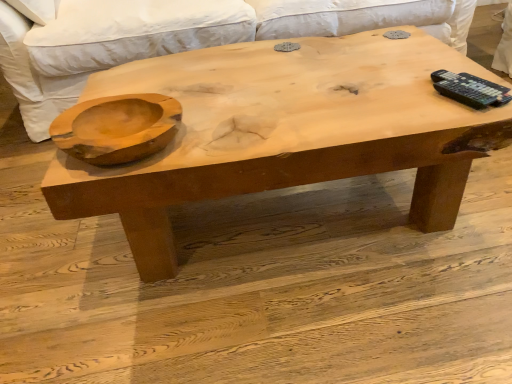
Question: Considering the relative sizes of natural wood coffee table at center and white fabric couch at upper center in the image provided, is natural wood coffee table at center thinner than white fabric couch at upper center?

Choices:
 (A) no
 (B) yes

Answer: (B)

Question: Considering the relative sizes of natural wood coffee table at center and white fabric couch at upper center in the image provided, is natural wood coffee table at center smaller than white fabric couch at upper center?

Choices:
 (A) yes
 (B) no

Answer: (A)

Question: From a real-world perspective, does natural wood coffee table at center stand above white fabric couch at upper center?

Choices:
 (A) no
 (B) yes

Answer: (A)

Question: From the image's perspective, is natural wood coffee table at center below white fabric couch at upper center?

Choices:
 (A) no
 (B) yes

Answer: (B)

Question: Are natural wood coffee table at center and white fabric couch at upper center far apart?

Choices:
 (A) yes
 (B) no

Answer: (B)

Question: From the image's perspective, is natural wood coffee table at center located above white fabric couch at upper center?

Choices:
 (A) yes
 (B) no

Answer: (B)

Question: Can you confirm if white fabric couch at upper center is wider than natural wood coffee table at center?

Choices:
 (A) yes
 (B) no

Answer: (A)

Question: Can we say white fabric couch at upper center lies outside natural wood coffee table at center?

Choices:
 (A) yes
 (B) no

Answer: (A)

Question: Is natural wood coffee table at center completely or partially inside white fabric couch at upper center?

Choices:
 (A) no
 (B) yes

Answer: (A)

Question: Is white fabric couch at upper center at the left side of natural wood coffee table at center?

Choices:
 (A) no
 (B) yes

Answer: (B)

Question: Is white fabric couch at upper center shorter than natural wood coffee table at center?

Choices:
 (A) yes
 (B) no

Answer: (B)

Question: Is white fabric couch at upper center positioned far away from natural wood coffee table at center?

Choices:
 (A) no
 (B) yes

Answer: (A)

Question: From a real-world perspective, is natural wood coffee table at center on top of natural wood bowl at left?

Choices:
 (A) no
 (B) yes

Answer: (A)